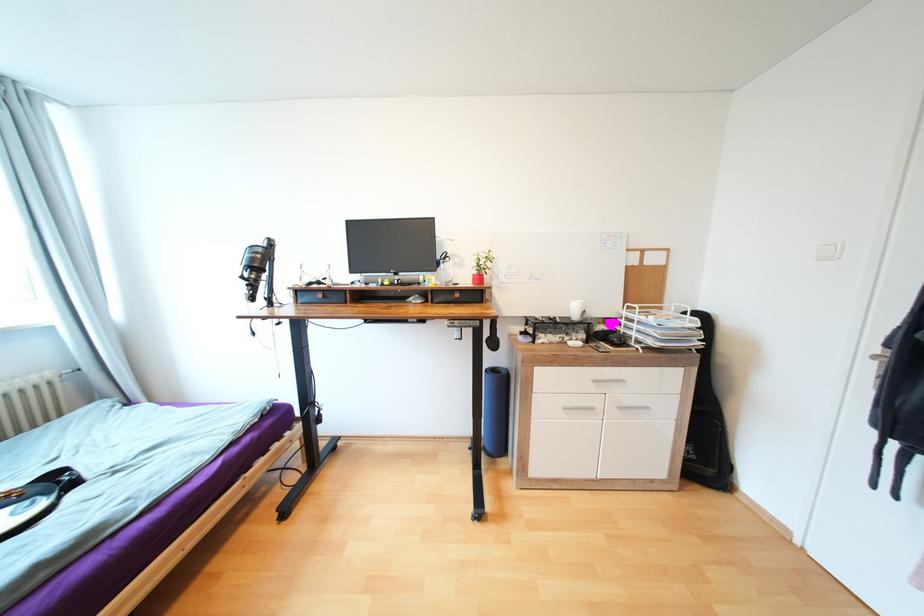
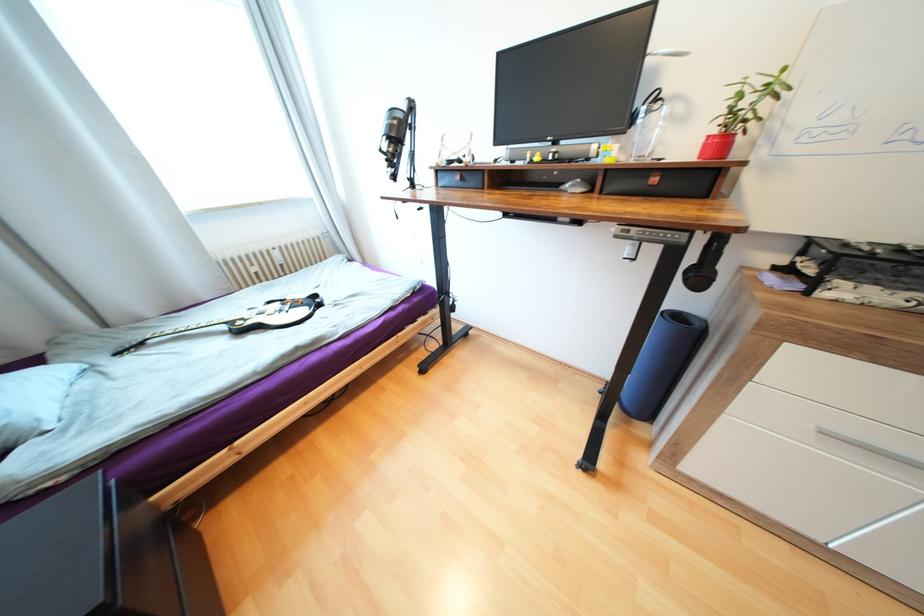
The point at (462,323) is marked in the first image. Where is the corresponding point in the second image?

(639, 230)